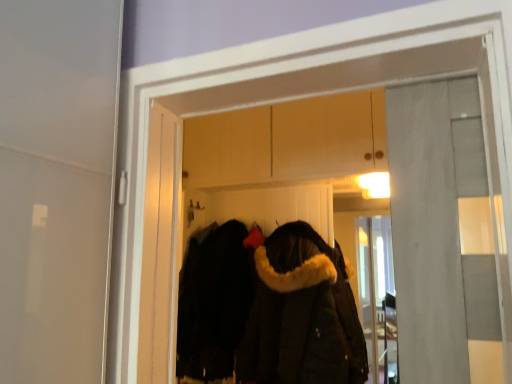
Question: Is black fuzzy coat at center, the first cloak from the left, positioned in front of dark brown fur-lined coat at center, the 2th cloak from the left?

Choices:
 (A) no
 (B) yes

Answer: (A)

Question: Is black fuzzy coat at center, the first cloak from the left, not within dark brown fur-lined coat at center, the 1th cloak in the right-to-left sequence?

Choices:
 (A) no
 (B) yes

Answer: (B)

Question: Is black fuzzy coat at center, the 2th cloak in the right-to-left sequence, at the right side of dark brown fur-lined coat at center, the 2th cloak from the left?

Choices:
 (A) yes
 (B) no

Answer: (B)

Question: Is dark brown fur-lined coat at center, the 2th cloak from the left, completely or partially inside black fuzzy coat at center, the first cloak from the left?

Choices:
 (A) yes
 (B) no

Answer: (B)

Question: Is black fuzzy coat at center, the first cloak from the left, turned away from dark brown fur-lined coat at center, the 1th cloak in the right-to-left sequence?

Choices:
 (A) yes
 (B) no

Answer: (B)

Question: From the image's perspective, is black fuzzy coat at center, the first cloak from the left, above or below black fur-lined coat at center?

Choices:
 (A) below
 (B) above

Answer: (A)

Question: From a real-world perspective, is black fuzzy coat at center, the first cloak from the left, physically located above or below black fur-lined coat at center?

Choices:
 (A) below
 (B) above

Answer: (A)

Question: From their relative heights in the image, would you say black fuzzy coat at center, the first cloak from the left, is taller or shorter than black fur-lined coat at center?

Choices:
 (A) tall
 (B) short

Answer: (B)

Question: Looking at their shapes, would you say black fuzzy coat at center, the first cloak from the left, is wider or thinner than black fur-lined coat at center?

Choices:
 (A) thin
 (B) wide

Answer: (B)

Question: Is black fuzzy coat at center, the first cloak from the left, taller or shorter than dark brown fur-lined coat at center, the 2th cloak from the left?

Choices:
 (A) short
 (B) tall

Answer: (A)

Question: Visually, is black fuzzy coat at center, the 2th cloak in the right-to-left sequence, positioned to the left or to the right of dark brown fur-lined coat at center, the 2th cloak from the left?

Choices:
 (A) right
 (B) left

Answer: (B)

Question: Is black fuzzy coat at center, the first cloak from the left, wider or thinner than dark brown fur-lined coat at center, the 2th cloak from the left?

Choices:
 (A) wide
 (B) thin

Answer: (A)

Question: From a real-world perspective, is black fuzzy coat at center, the 2th cloak in the right-to-left sequence, physically located above or below dark brown fur-lined coat at center, the 1th cloak in the right-to-left sequence?

Choices:
 (A) above
 (B) below

Answer: (A)

Question: In the image, is black fur-lined coat at center positioned in front of or behind black fuzzy coat at center, the first cloak from the left?

Choices:
 (A) behind
 (B) front

Answer: (B)

Question: Is black fur-lined coat at center wider or thinner than black fuzzy coat at center, the 2th cloak in the right-to-left sequence?

Choices:
 (A) wide
 (B) thin

Answer: (B)